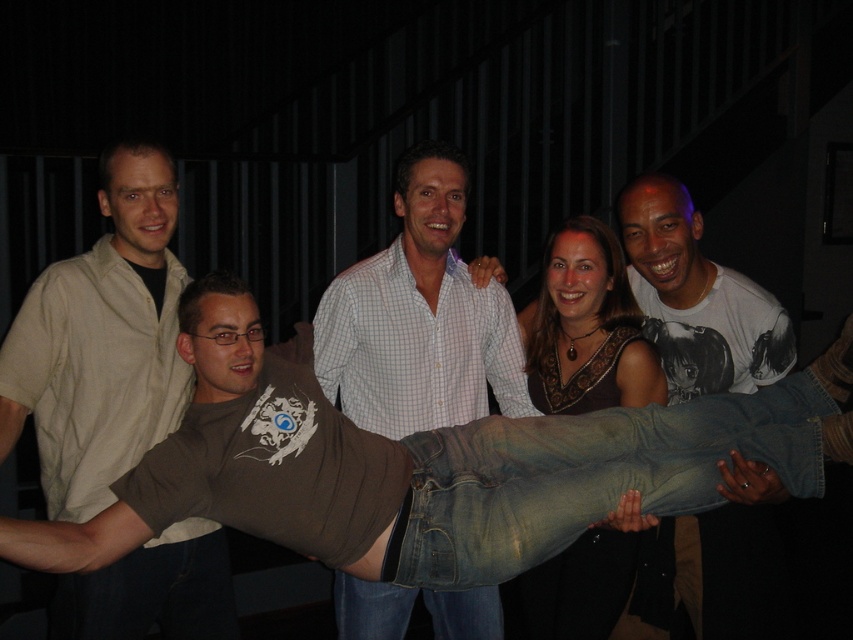
Question: Which object is the farthest from the white printed t-shirt at right?

Choices:
 (A) light beige shirt at left
 (B) white checkered shirt at center

Answer: (A)

Question: Which of these objects is positioned farthest from the light beige shirt at left?

Choices:
 (A) jeans at center
 (B) white printed t-shirt at right
 (C) white checkered shirt at center

Answer: (B)

Question: Is jeans at center to the right of light beige shirt at left from the viewer's perspective?

Choices:
 (A) no
 (B) yes

Answer: (B)

Question: Is jeans at center smaller than white checkered shirt at center?

Choices:
 (A) yes
 (B) no

Answer: (B)

Question: Is the position of jeans at center more distant than that of white printed t-shirt at right?

Choices:
 (A) yes
 (B) no

Answer: (B)

Question: Which object appears closest to the camera in this image?

Choices:
 (A) jeans at center
 (B) white printed t-shirt at right

Answer: (A)